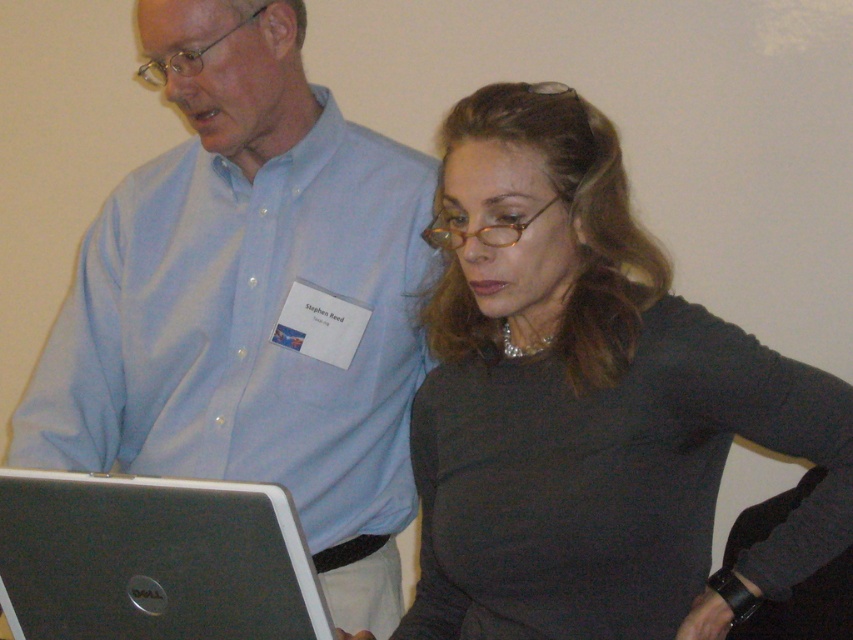
Does matte blue shirt at center come in front of silver metallic laptop at lower left?

No.

The width and height of the screenshot is (853, 640). In order to click on matte blue shirt at center in this screenshot , I will do pos(251,301).

Between matte gray sweater at center and silver metallic laptop at lower left, which one has less height?

Standing shorter between the two is silver metallic laptop at lower left.

Is matte gray sweater at center smaller than silver metallic laptop at lower left?

No, matte gray sweater at center is not smaller than silver metallic laptop at lower left.

Identify the location of matte gray sweater at center. The image size is (853, 640). pos(589,401).

Can you confirm if matte gray sweater at center is taller than matte blue shirt at center?

Incorrect, matte gray sweater at center's height is not larger of matte blue shirt at center's.

Is matte gray sweater at center thinner than matte blue shirt at center?

Yes.

Is point (488, 496) positioned behind point (242, 433)?

No.

Locate an element on the screen. Image resolution: width=853 pixels, height=640 pixels. matte gray sweater at center is located at coordinates (589, 401).